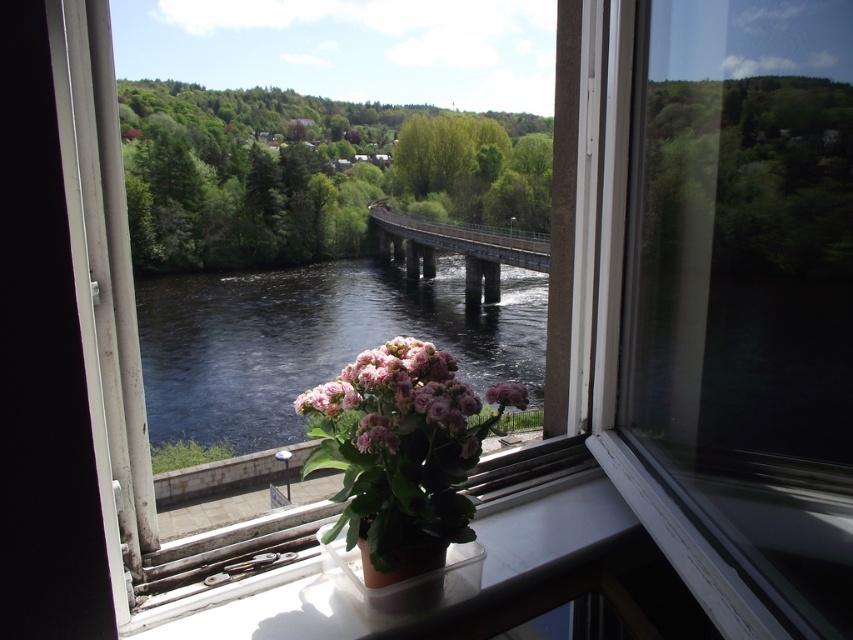
The height and width of the screenshot is (640, 853). What are the coordinates of `dark blue water at center` in the screenshot? It's located at (312, 340).

Is dark blue water at center above concrete bridge at center?

Actually, dark blue water at center is below concrete bridge at center.

Where is `dark blue water at center`? This screenshot has width=853, height=640. dark blue water at center is located at coordinates (312, 340).

How far apart are dark blue water at center and pink matte flower at center?

74.04 meters

Who is positioned more to the left, dark blue water at center or pink matte flower at center?

Positioned to the left is dark blue water at center.

Is point (247, 364) closer to viewer compared to point (473, 449)?

That is False.

Where is `dark blue water at center`? Image resolution: width=853 pixels, height=640 pixels. dark blue water at center is located at coordinates (312, 340).

Does dark blue water at center come in front of plastic/transparent pot at bottom?

No, it is not.

The image size is (853, 640). Identify the location of dark blue water at center. (312, 340).